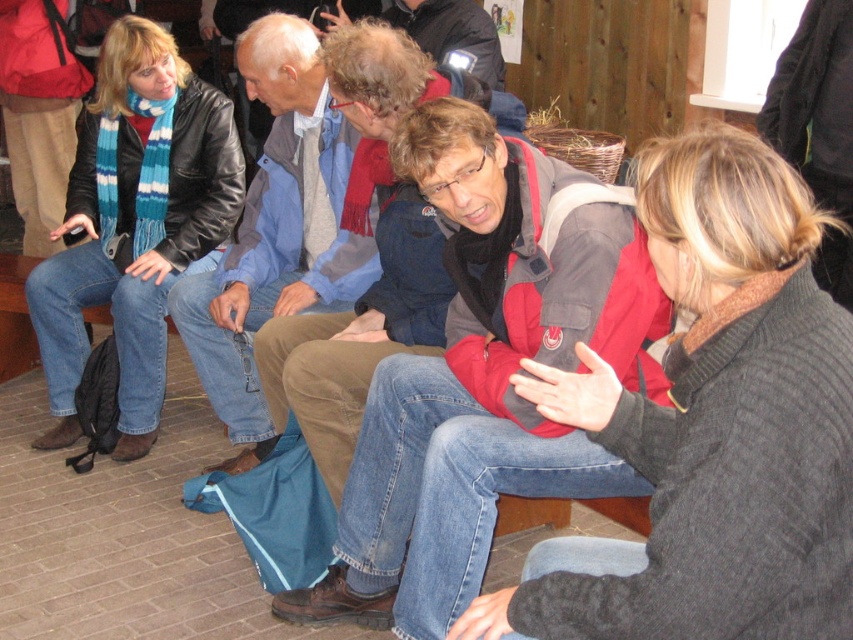
Question: Does knitted dark gray sweater at center appear on the right side of matte gray jacket at center?

Choices:
 (A) no
 (B) yes

Answer: (B)

Question: Is matte black leather jacket at left above blue denim jeans at center?

Choices:
 (A) yes
 (B) no

Answer: (A)

Question: Which object appears farthest from the camera in this image?

Choices:
 (A) knitted dark gray sweater at center
 (B) blue denim jeans at center
 (C) matte gray jacket at center
 (D) matte black leather jacket at left

Answer: (D)

Question: Can you confirm if matte gray jacket at center is positioned below blue denim jeans at center?

Choices:
 (A) yes
 (B) no

Answer: (A)

Question: Estimate the real-world distances between objects in this image. Which object is farther from the matte black leather jacket at left?

Choices:
 (A) matte gray jacket at center
 (B) blue denim jeans at center

Answer: (A)

Question: Considering the real-world distances, which object is farthest from the matte black leather jacket at left?

Choices:
 (A) knitted dark gray sweater at center
 (B) matte gray jacket at center

Answer: (A)